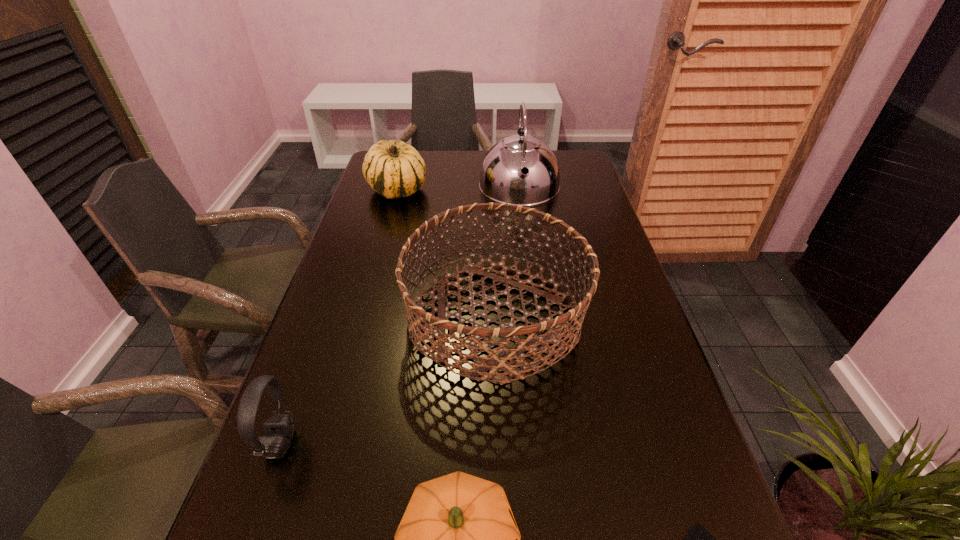
What are the coordinates of `free area in between the headset and the kettle` in the screenshot? It's located at (400, 315).

The image size is (960, 540). I want to click on vacant space that is in between the headset and the basket, so click(x=388, y=380).

Identify the location of free space between the tallest object and the basket. This screenshot has width=960, height=540. (508, 252).

You are a GUI agent. You are given a task and a screenshot of the screen. Output one action in this format:
    pyautogui.click(x=<x>, y=<y>)
    Task: Click on the free space between the fourth farthest object and the kettle
    
    Given the screenshot: What is the action you would take?
    pyautogui.click(x=400, y=315)

At what (x,y) coordinates should I click in order to perform the action: click on empty location between the fourth farthest object and the kettle. Please return your answer as a coordinate pair (x, y). This screenshot has height=540, width=960. Looking at the image, I should click on (400, 315).

Select which object appears as the fourth closest to the third nearest object. Please provide its 2D coordinates. Your answer should be formatted as a tuple, i.e. [(x, y)], where the tuple contains the x and y coordinates of a point satisfying the conditions above.

[(394, 169)]

Identify which object is the third closest to the shortest object. Please provide its 2D coordinates. Your answer should be formatted as a tuple, i.e. [(x, y)], where the tuple contains the x and y coordinates of a point satisfying the conditions above.

[(279, 428)]